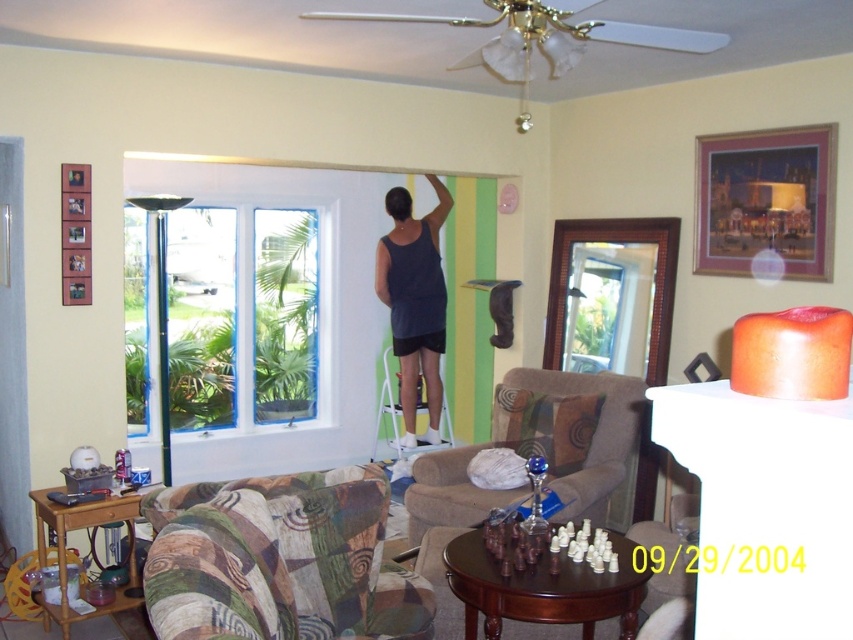
You are a painter standing in the living room. You need to move the multicolored fabric couch at center to access the white painted window at left for cleaning. Based on their positions, can you move the couch to the left of the window?

The white painted window at left is positioned on the left side of multicolored fabric couch at center, meaning the couch is already to the right of the window. Moving it further left would place it in front of or near the window, so yes, you can move the multicolored fabric couch at center to the left of the white painted window at left by shifting it towards the window.

You are a guest entering the living room and want to sit on the multicolored fabric couch at center. Which direction should you walk to ensure you are facing the white painted window at left?

The white painted window at left is positioned over the multicolored fabric couch at center, so if you are sitting on the multicolored fabric couch at center, you would face toward the left to look at the white painted window at left. Therefore, to face the window, you should walk towards the left side of the couch.

You are a painter standing in the living room. You need to ensure that the white painted window at left is visible from the front door. Based on its coordinates, can you confirm if the window is positioned on the left side of the room?

The white painted window at left is positioned at coordinates point (x=183, y=314), which places it on the left side of the room, so yes, it is visible from the front door.